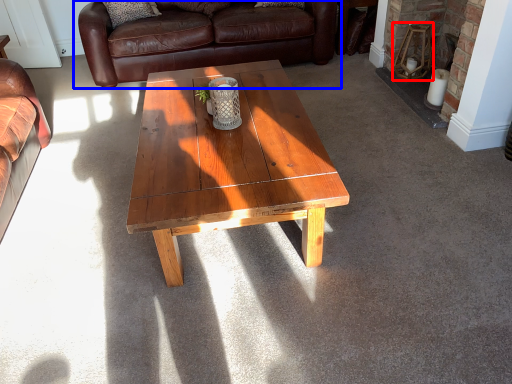
Question: Which object appears farthest to the camera in this image, stool (highlighted by a red box) or studio couch (highlighted by a blue box)?

Choices:
 (A) stool
 (B) studio couch

Answer: (B)